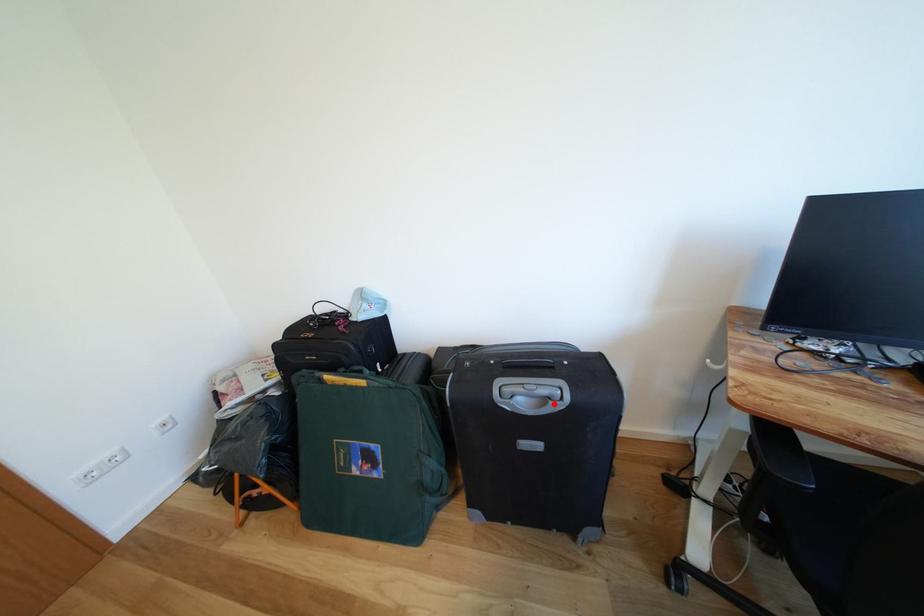
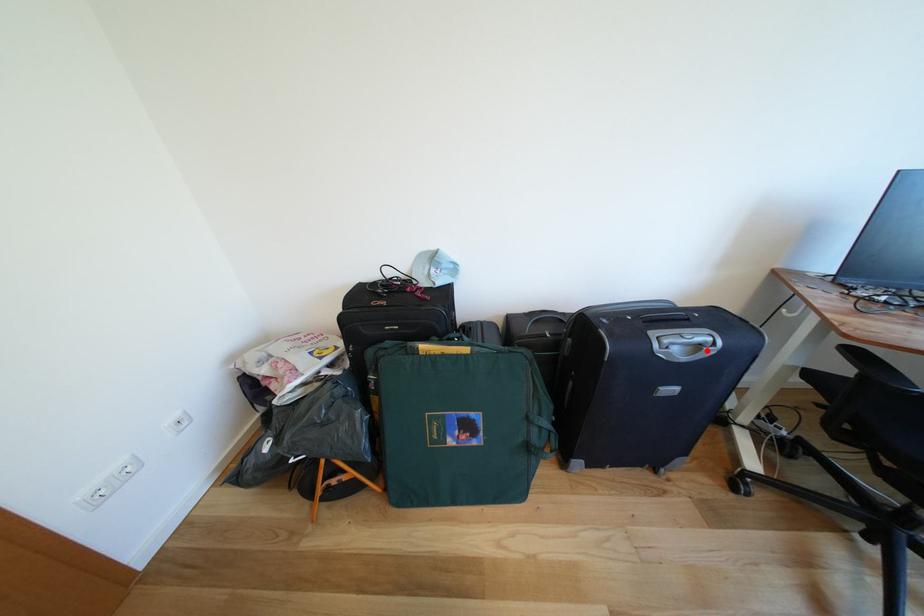
I am providing you with two images of the same scene from different viewpoints. A red point is marked on the first image and another point is marked on the second image. Does the point marked in image1 correspond to the same location as the one in image2?

Yes